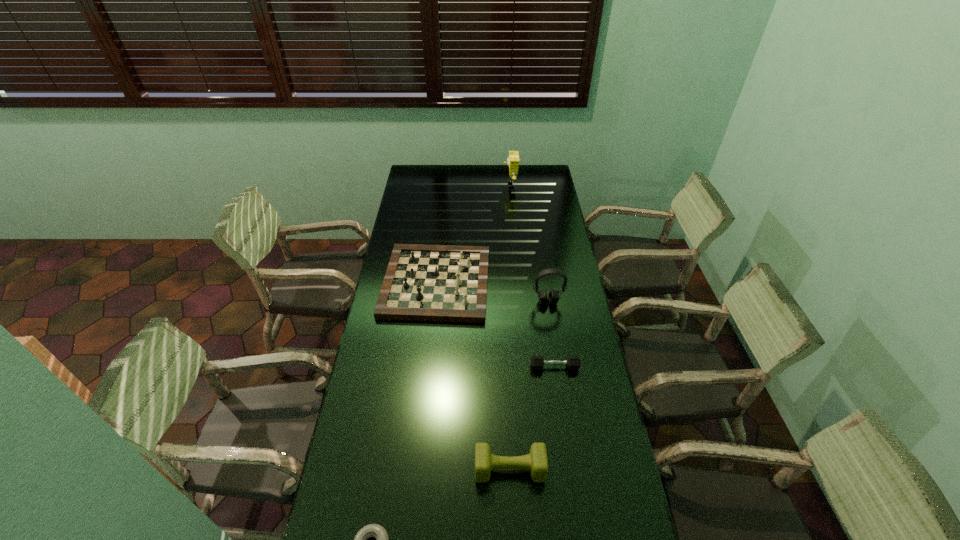
Find the location of a particular element. the farthest object is located at coordinates (513, 160).

The width and height of the screenshot is (960, 540). In order to click on headset in this screenshot , I will do `click(553, 297)`.

Where is `chessboard`? chessboard is located at coordinates (448, 283).

The image size is (960, 540). Find the location of `the fifth farthest object`. the fifth farthest object is located at coordinates pyautogui.click(x=536, y=462).

The width and height of the screenshot is (960, 540). Identify the location of the taller dumbbell. (536, 462).

Identify the location of the fifth tallest object. Image resolution: width=960 pixels, height=540 pixels. (537, 362).

Locate an element on the screen. The width and height of the screenshot is (960, 540). the shorter dumbbell is located at coordinates (537, 362).

The image size is (960, 540). Find the location of `free location located 0.340m on the front-facing side of the sponge`. free location located 0.340m on the front-facing side of the sponge is located at coordinates (441, 185).

What are the coordinates of `vacant space positioned 0.330m on the front-facing side of the sponge` in the screenshot? It's located at (443, 185).

Find the location of a particular element. free space located on the front-facing side of the sponge is located at coordinates (452, 185).